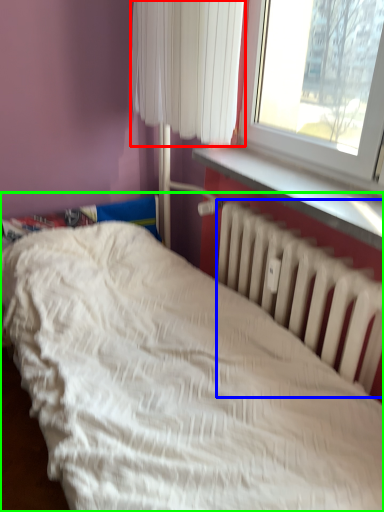
Question: Which object is positioned farthest from curtain (highlighted by a red box)? Select from radiator (highlighted by a blue box) and bed (highlighted by a green box).

Choices:
 (A) radiator
 (B) bed

Answer: (B)